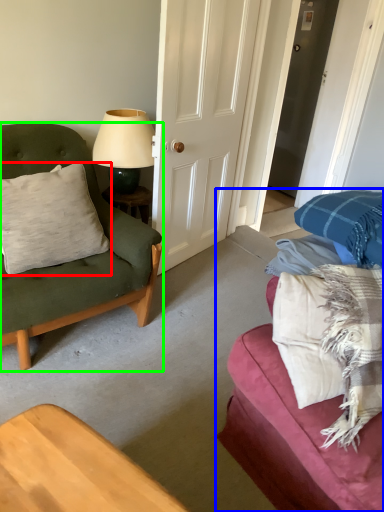
Question: Which object is positioned closest to pillow (highlighted by a red box)? Select from studio couch (highlighted by a blue box) and chair (highlighted by a green box).

Choices:
 (A) studio couch
 (B) chair

Answer: (B)